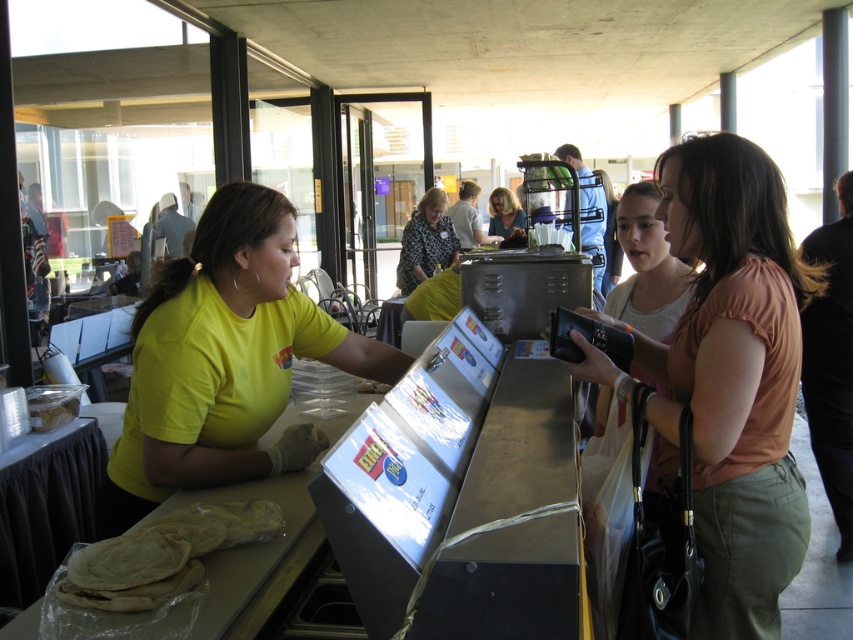
Looking at this image, you are a customer at the counter and want to see the person behind the counter clearly. Which item, the matte peach blouse at center or the matte yellow shirt at center, is closer to you?

The matte yellow shirt at center is closer to you because the matte peach blouse at center is positioned under it, meaning the yellow shirt is above and therefore nearer in the visual plane.

You are a customer at the counter and need to reach both the translucent plastic tortillas at center and the light brown leather jacket at right. Which item is closer to you from your perspective?

The translucent plastic tortillas at center is located below the light brown leather jacket at right, so from your perspective at the counter, the light brown leather jacket at right is closer to you.

You are a photographer standing at the counter and want to take a photo of the patterned fabric blouse at center without the matte black camera at center appearing in the shot. Can you move sideways to avoid the camera?

The distance between the patterned fabric blouse at center and the matte black camera at center is 33.59 inches, so moving sideways by at least 33.59 inches would allow you to position yourself where the camera is no longer in the frame.